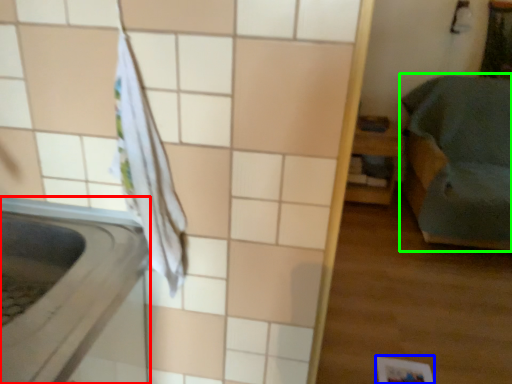
Question: Which is nearer to the appliance (highlighted by a red box)? square (highlighted by a blue box) or furniture (highlighted by a green box).

Choices:
 (A) square
 (B) furniture

Answer: (A)